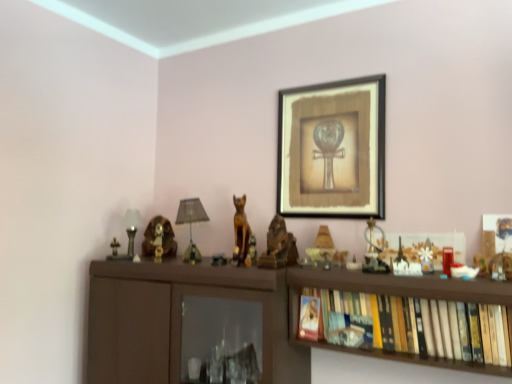
Question: Is matte gold lamp at center-right, which appears as the 3th toy when viewed from the back, in front of or behind metallic gold statue at center, which appears as the second toy when viewed from the back, in the image?

Choices:
 (A) front
 (B) behind

Answer: (A)

Question: In terms of size, does matte gold lamp at center-right, which ranks as the 3th toy in front-to-back order, appear bigger or smaller than metallic gold statue at center, which ranks as the 4th toy in right-to-left order?

Choices:
 (A) small
 (B) big

Answer: (B)

Question: Which of these objects is positioned closest to the hardcover books at right, which appears as the 2th book when viewed from the back?

Choices:
 (A) matte gold lamp at center-right, which is the 3th toy from right to left
 (B) matte paper book at lower right, acting as the 2th book starting from the front
 (C) wooden picture frame at upper center
 (D) metallic gold clock at center-right, which ranks as the second toy in right-to-left order
 (E) matte black table lamp at center, the 2th table lamp when ordered from left to right

Answer: (D)

Question: Estimate the real-world distances between objects in this image. Which object is closer to the hardcover books at right, the 2th book positioned from the left?

Choices:
 (A) metallic gold figurine at left, marked as the first toy in a back-to-front arrangement
 (B) metallic gold clock at center-right, the fourth toy from the back
 (C) wooden statue at center, marked as the first animal in a front-to-back arrangement
 (D) wooden cat at center, the 2th animal in the back-to-front sequence
 (E) matte gold lamp at center-right, which is the 3th toy from right to left

Answer: (B)